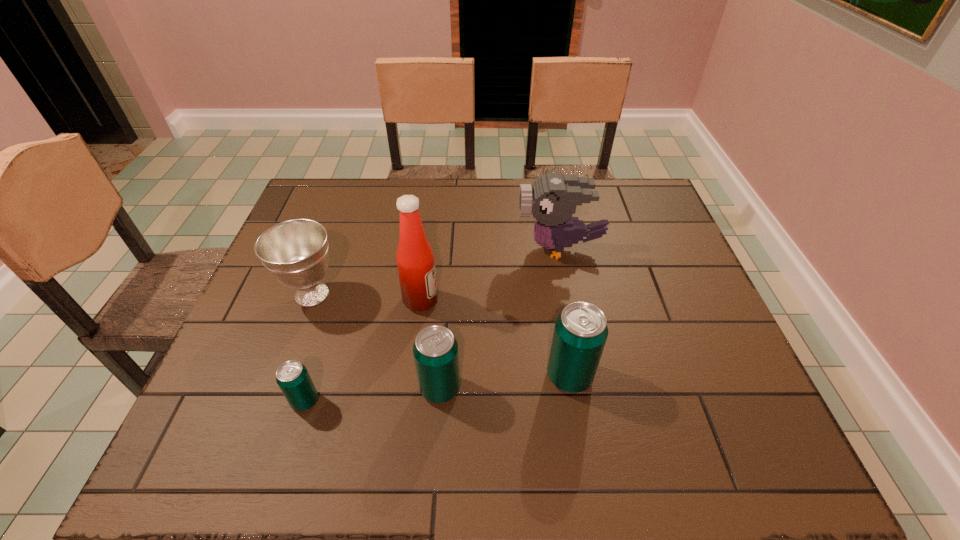
Locate an element on the screen. the shortest beer can is located at coordinates (292, 377).

Identify the location of the shortest object. (292, 377).

The height and width of the screenshot is (540, 960). Identify the location of the second beer can from left to right. (435, 350).

Find the location of a particular element. the rightmost beer can is located at coordinates (580, 333).

Identify the location of the farthest object. This screenshot has height=540, width=960. (552, 199).

At what (x,y) coordinates should I click in order to perform the action: click on the tallest object. Please return your answer as a coordinate pair (x, y). This screenshot has height=540, width=960. Looking at the image, I should click on (415, 260).

The image size is (960, 540). Find the location of `chalice`. chalice is located at coordinates (295, 252).

In order to click on free space located 0.090m on the back of the shortest beer can in this screenshot , I will do coord(320,353).

Find the location of a particular element. The image size is (960, 540). vacant space situated on the left of the second tallest beer can is located at coordinates (324, 388).

Where is `blank area located 0.350m on the back of the rightmost beer can`? blank area located 0.350m on the back of the rightmost beer can is located at coordinates (549, 252).